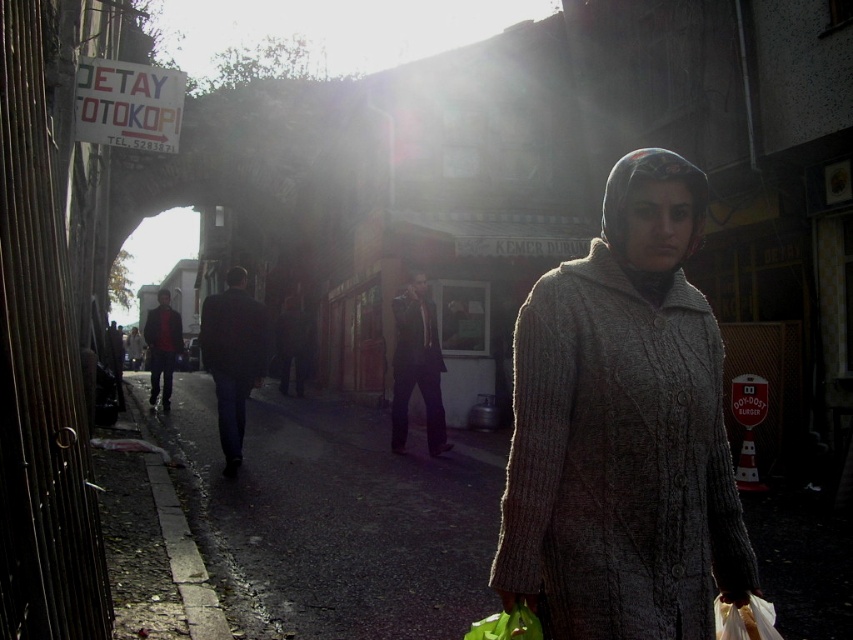
Can you confirm if dark suit at center is smaller than red sweater at center?

Yes.

Is dark suit at center in front of red sweater at center?

Yes.

Is point (426, 349) positioned after point (152, 372)?

No, (426, 349) is closer to viewer.

Locate an element on the screen. dark suit at center is located at coordinates (416, 365).

Is dark blue suit at center bigger than dark suit at center?

Yes.

Who is taller, dark blue suit at center or dark suit at center?

Standing taller between the two is dark suit at center.

Measure the distance between point (242, 385) and camera.

Point (242, 385) is 8.18 meters from camera.

Where is `dark blue suit at center`? This screenshot has height=640, width=853. dark blue suit at center is located at coordinates (233, 356).

Does point (595, 268) lie in front of point (163, 396)?

Yes, it is.

Who is higher up, knitted gray coat at center or red sweater at center?

knitted gray coat at center is higher up.

This screenshot has width=853, height=640. What do you see at coordinates (624, 429) in the screenshot?
I see `knitted gray coat at center` at bounding box center [624, 429].

I want to click on knitted gray coat at center, so click(x=624, y=429).